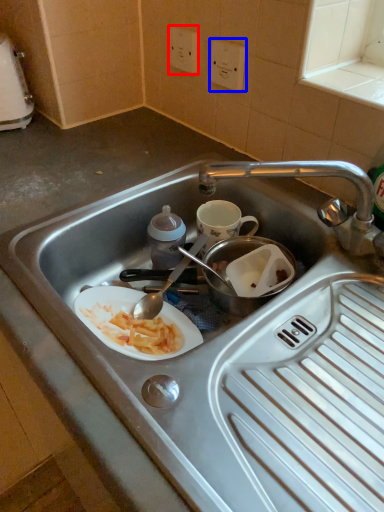
Question: Which object appears closest to the camera in this image, electric outlet (highlighted by a red box) or electric outlet (highlighted by a blue box)?

Choices:
 (A) electric outlet
 (B) electric outlet

Answer: (B)